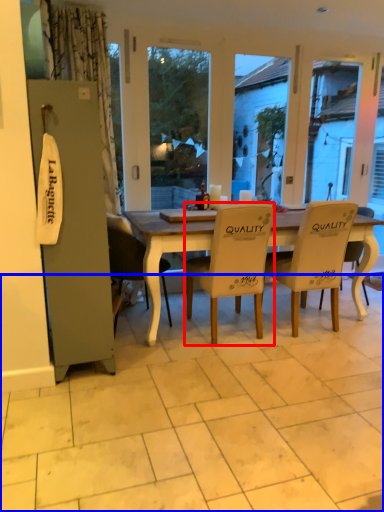
Question: Among these objects, which one is nearest to the camera, chair (highlighted by a red box) or tile (highlighted by a blue box)?

Choices:
 (A) chair
 (B) tile

Answer: (B)